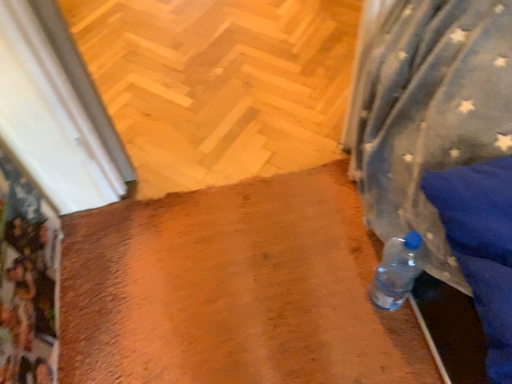
Question: From a real-world perspective, is clear plastic bottle at lower right positioned above or below wooden floor at center?

Choices:
 (A) above
 (B) below

Answer: (A)

Question: Is clear plastic bottle at lower right wider or thinner than wooden floor at center?

Choices:
 (A) wide
 (B) thin

Answer: (B)

Question: From the image's perspective, is clear plastic bottle at lower right above or below wooden floor at center?

Choices:
 (A) above
 (B) below

Answer: (B)

Question: Based on their sizes in the image, would you say wooden floor at center is bigger or smaller than clear plastic bottle at lower right?

Choices:
 (A) small
 (B) big

Answer: (B)

Question: Relative to clear plastic bottle at lower right, is wooden floor at center in front or behind?

Choices:
 (A) behind
 (B) front

Answer: (A)

Question: From the image's perspective, is wooden floor at center positioned above or below clear plastic bottle at lower right?

Choices:
 (A) below
 (B) above

Answer: (B)

Question: Visually, is wooden floor at center positioned to the left or to the right of clear plastic bottle at lower right?

Choices:
 (A) left
 (B) right

Answer: (A)